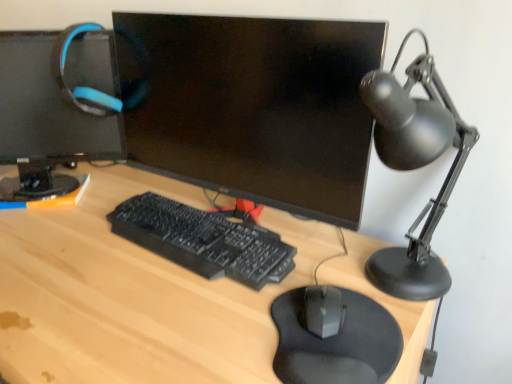
Locate an element on the screen. This screenshot has height=384, width=512. free space in front of matte black monitor at center, acting as the 1th computer monitor starting from the right is located at coordinates (185, 308).